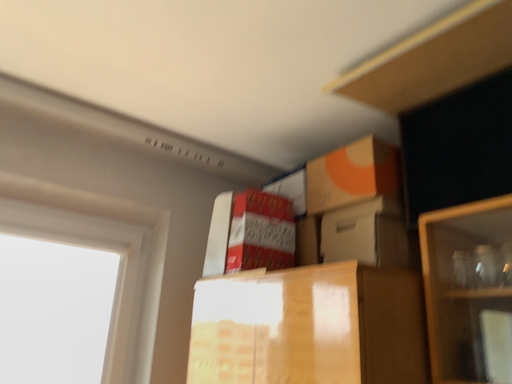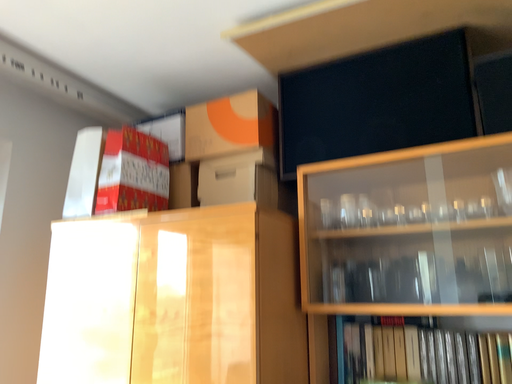
Question: How did the camera likely rotate when shooting the video?

Choices:
 (A) rotated downward
 (B) rotated upward

Answer: (A)